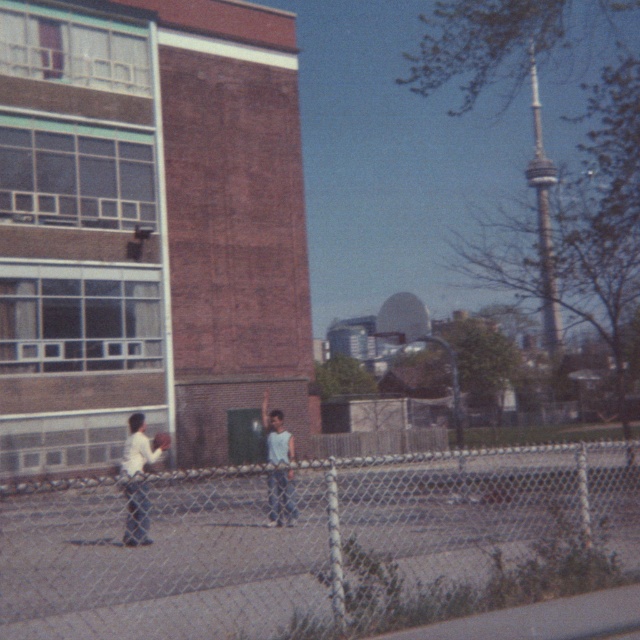
Who is higher up, white matte basketball at left or light blue t-shirt at center?

light blue t-shirt at center is above.

Does white matte basketball at left have a smaller size compared to light blue t-shirt at center?

Actually, white matte basketball at left might be larger than light blue t-shirt at center.

Where is `white matte basketball at left`? The height and width of the screenshot is (640, 640). white matte basketball at left is located at coordinates (138, 477).

Which is above, metal chain-link fence at lower center or white matte basketball at left?

white matte basketball at left is higher up.

Which is below, metal chain-link fence at lower center or white matte basketball at left?

Positioned lower is metal chain-link fence at lower center.

Describe the element at coordinates (317, 544) in the screenshot. I see `metal chain-link fence at lower center` at that location.

What are the coordinates of `metal chain-link fence at lower center` in the screenshot? It's located at (317, 544).

Locate an element on the screen. The width and height of the screenshot is (640, 640). metal chain-link fence at lower center is located at coordinates (317, 544).

Does metal chain-link fence at lower center appear on the right side of light blue t-shirt at center?

Correct, you'll find metal chain-link fence at lower center to the right of light blue t-shirt at center.

Find the location of a particular element. This screenshot has height=640, width=640. metal chain-link fence at lower center is located at coordinates (317, 544).